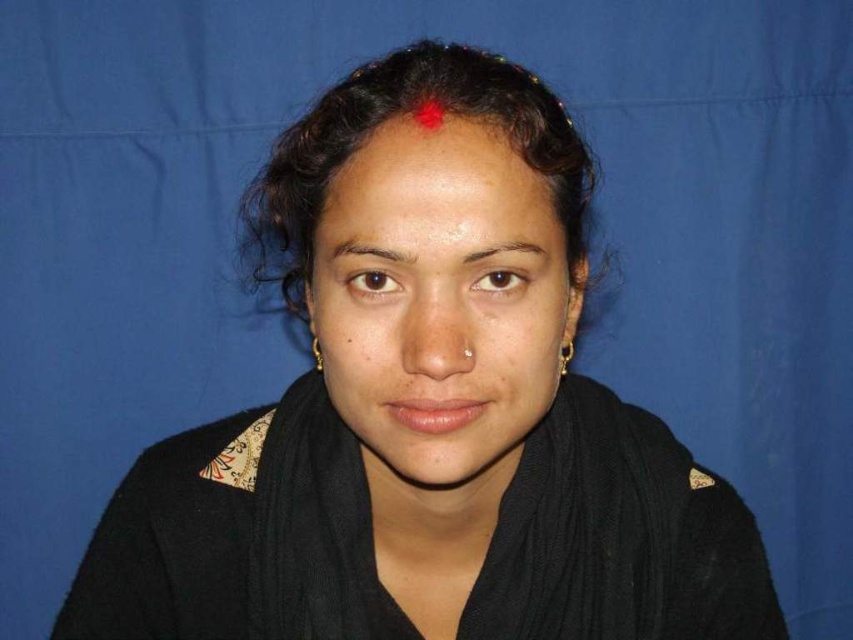
You are a photographer adjusting the focus on your camera. You want to ensure both the black knitted scarf at center and the brown smooth eyebrow at upper center are in focus. Which object should you focus on first to ensure the other is also in focus?

You should focus on the black knitted scarf at center first because it is closer to the viewer than the brown smooth eyebrow at upper center. By focusing on the closer object, the depth of field may include the farther one as well.

You are a fashion designer analyzing the image. You need to decide which item is larger in size between the black knitted scarf at center and the brown smooth eyebrow at upper center. Which one is bigger?

The black knitted scarf at center is bigger than the brown smooth eyebrow at upper center.

Looking at the person in the image, which of the two eyebrows, the brown smooth eyebrow at upper center or the brown matte eyebrow at center, appears to be smaller in size?

The brown smooth eyebrow at upper center occupies less space than the brown matte eyebrow at center, so it appears smaller in size.